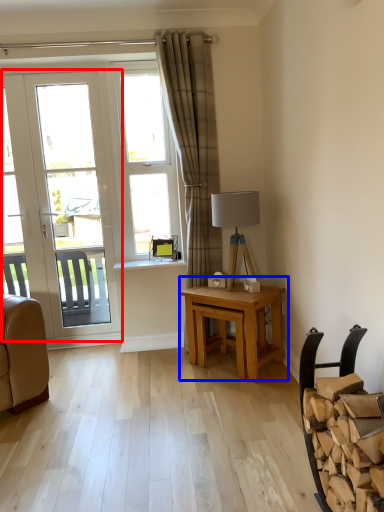
Question: Among these objects, which one is nearest to the camera, door (highlighted by a red box) or table (highlighted by a blue box)?

Choices:
 (A) door
 (B) table

Answer: (B)